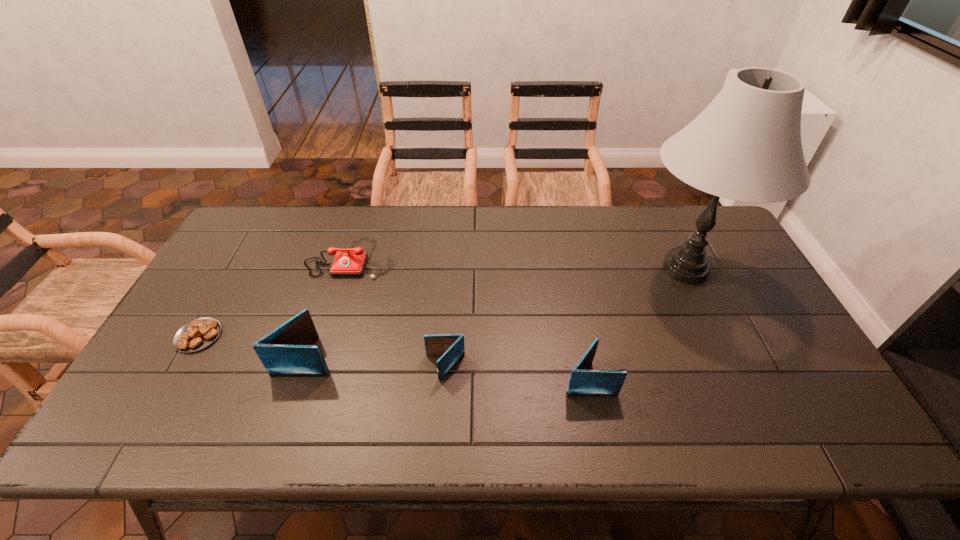
Identify the location of free point at the near right corner. This screenshot has height=540, width=960. (778, 391).

Find the location of a particular element. free space between the second wallet from left to right and the second object from right to left is located at coordinates (516, 373).

This screenshot has width=960, height=540. Find the location of `vacant point located between the fifth shortest object and the shortest object`. vacant point located between the fifth shortest object and the shortest object is located at coordinates (x=252, y=346).

Locate an element on the screen. This screenshot has width=960, height=540. vacant space in between the fifth object from left to right and the second wallet from right to left is located at coordinates (516, 373).

Locate an element on the screen. This screenshot has height=540, width=960. free space between the shortest object and the tallest object is located at coordinates (442, 302).

This screenshot has width=960, height=540. Find the location of `free area in between the lamp and the rightmost wallet`. free area in between the lamp and the rightmost wallet is located at coordinates (637, 323).

I want to click on free area in between the telephone and the second wallet from left to right, so click(398, 313).

The height and width of the screenshot is (540, 960). In order to click on vacant space that's between the telephone and the fourth object from left to right in this screenshot , I will do `click(398, 313)`.

At what (x,y) coordinates should I click in order to perform the action: click on vacant area that lies between the second shortest wallet and the leftmost object. Please return your answer as a coordinate pair (x, y). Looking at the image, I should click on (394, 357).

The height and width of the screenshot is (540, 960). Identify the location of vacant space in between the second wallet from left to right and the pastry. coord(322,352).